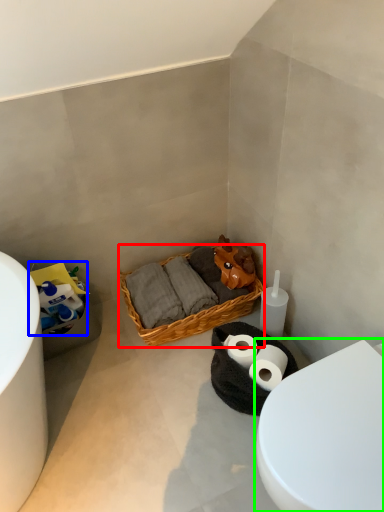
Question: Which is farther away from picnic basket (highlighted by a red box)? toilet paper (highlighted by a blue box) or toilet (highlighted by a green box)?

Choices:
 (A) toilet paper
 (B) toilet

Answer: (B)